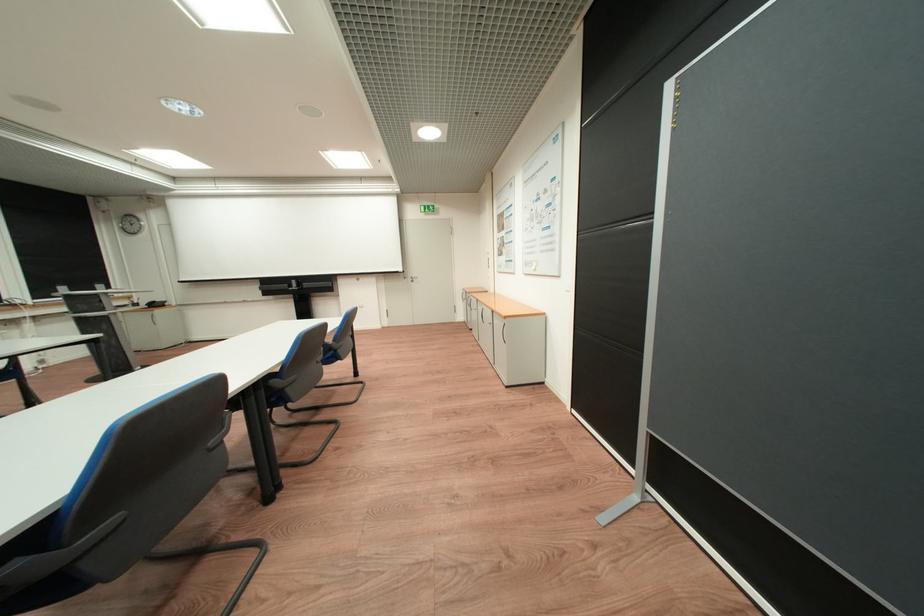
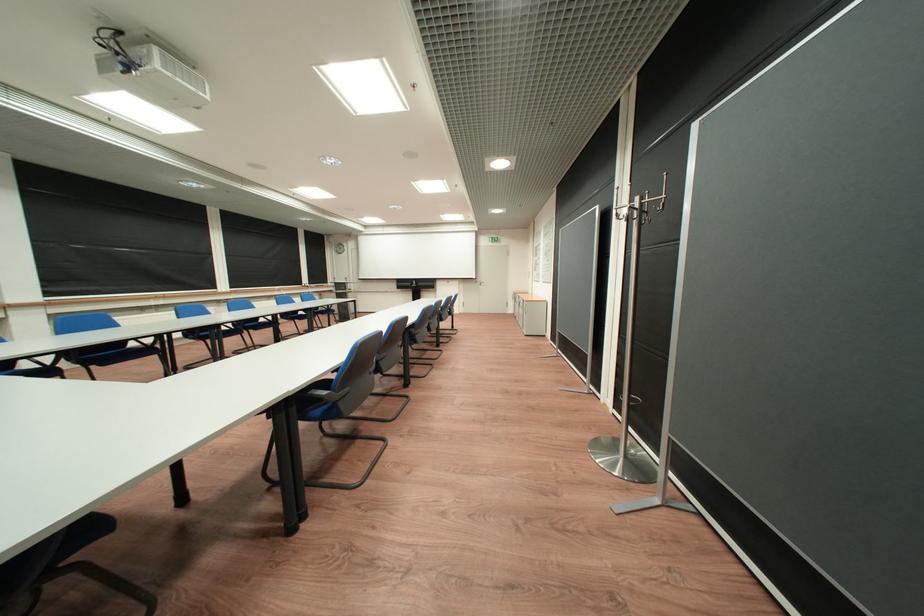
Locate, in the second image, the point that corresponds to pixel 414 272 in the first image.

(487, 278)